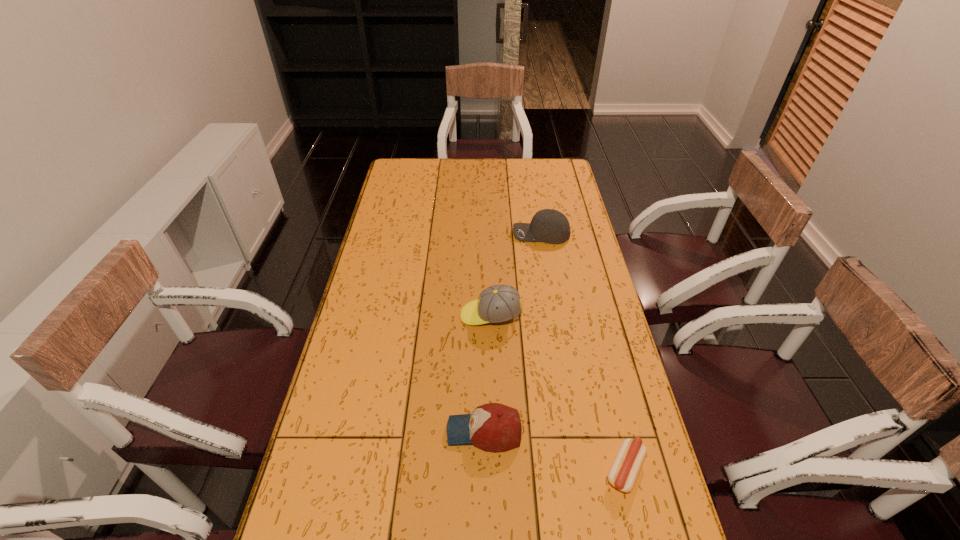
Locate an element on the screen. The width and height of the screenshot is (960, 540). the second farthest object is located at coordinates (498, 303).

Find the location of a particular element. This screenshot has width=960, height=540. the farthest baseball cap is located at coordinates (551, 226).

You are a GUI agent. You are given a task and a screenshot of the screen. Output one action in this format:
    pyautogui.click(x=<x>, y=<y>)
    Task: Click on the nearest baseball cap
    The image size is (960, 540).
    Given the screenshot: What is the action you would take?
    pyautogui.click(x=493, y=427)

Where is `the shortest baseball cap`? The image size is (960, 540). the shortest baseball cap is located at coordinates (493, 427).

What are the coordinates of `the shortest object` in the screenshot? It's located at (627, 465).

Identify the location of vacant point located on the front-facing side of the second farthest object. This screenshot has width=960, height=540. 374,315.

Find the location of a particular element. The width and height of the screenshot is (960, 540). blank space located on the front-facing side of the second farthest object is located at coordinates 442,315.

Locate an element on the screen. blank space located on the front-facing side of the second farthest object is located at coordinates (380, 315).

This screenshot has width=960, height=540. I want to click on vacant space situated 0.350m on the front brim of the farthest object, so click(x=424, y=234).

Where is `vacant area situated 0.390m on the front brim of the farthest object`? The width and height of the screenshot is (960, 540). vacant area situated 0.390m on the front brim of the farthest object is located at coordinates (415, 234).